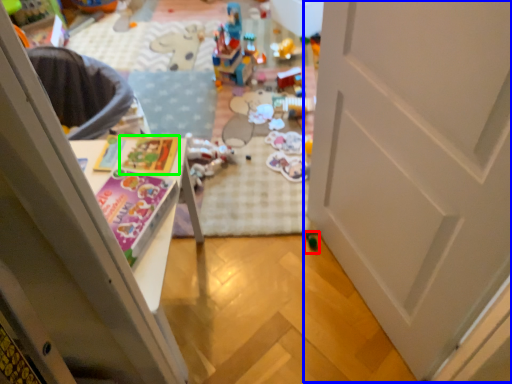
Question: Which is nearer to the toy (highlighted by a red box)? door (highlighted by a blue box) or magazine (highlighted by a green box).

Choices:
 (A) door
 (B) magazine

Answer: (A)